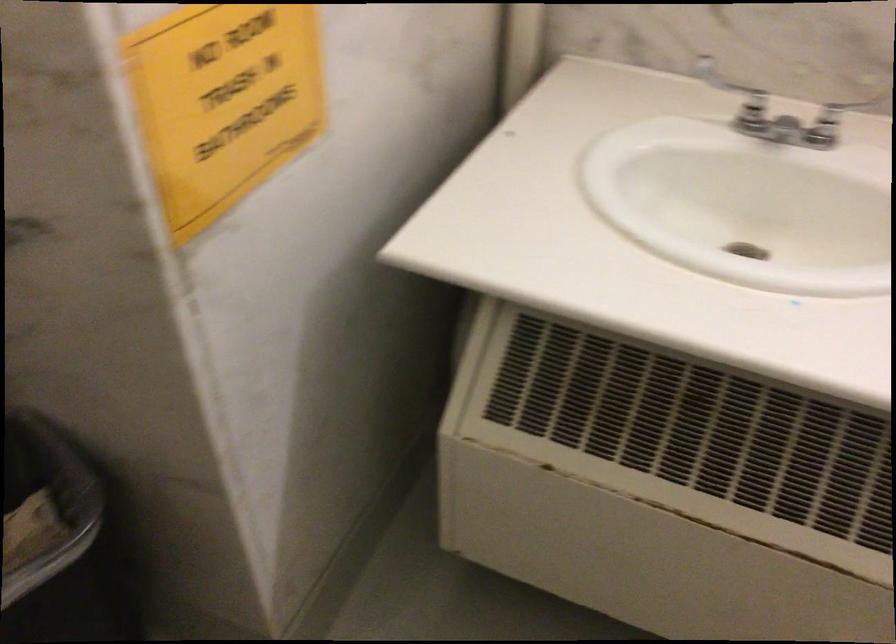
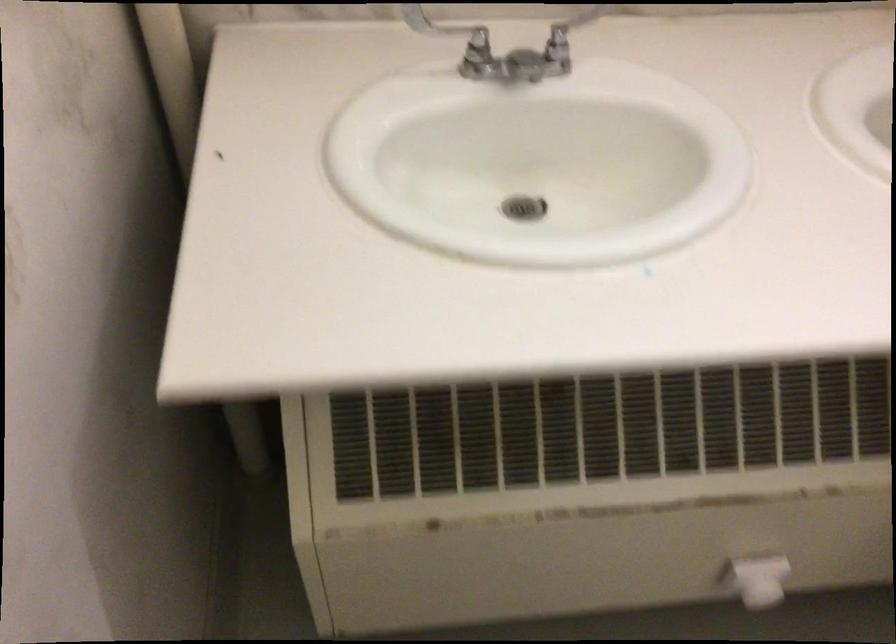
Find the pixel in the second image that matches the point at 748,93 in the first image.

(476, 37)